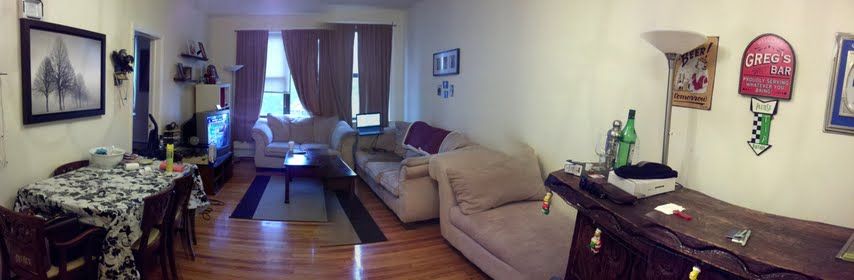
Where is `surfaces`? This screenshot has width=854, height=280. surfaces is located at coordinates (711, 225), (301, 156), (114, 181), (217, 161).